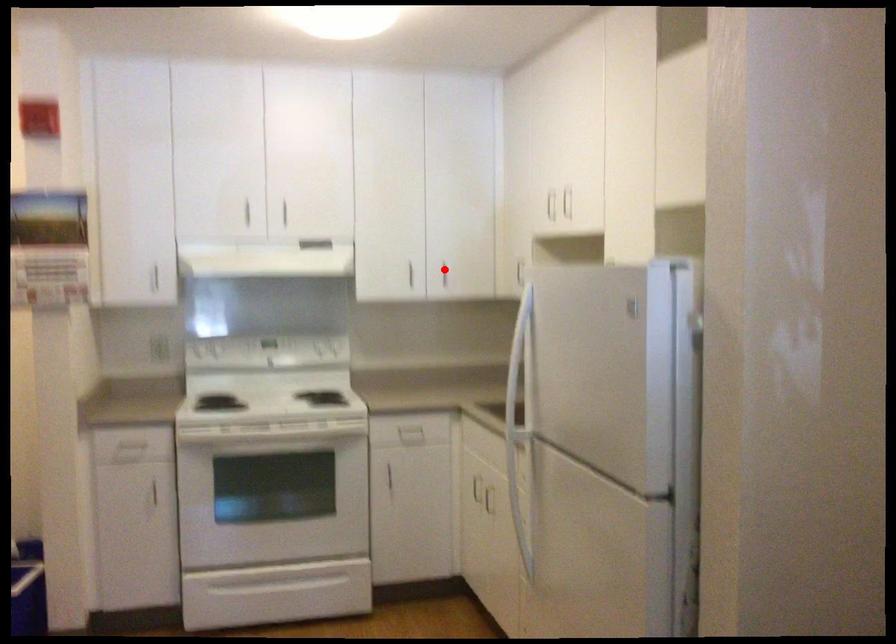
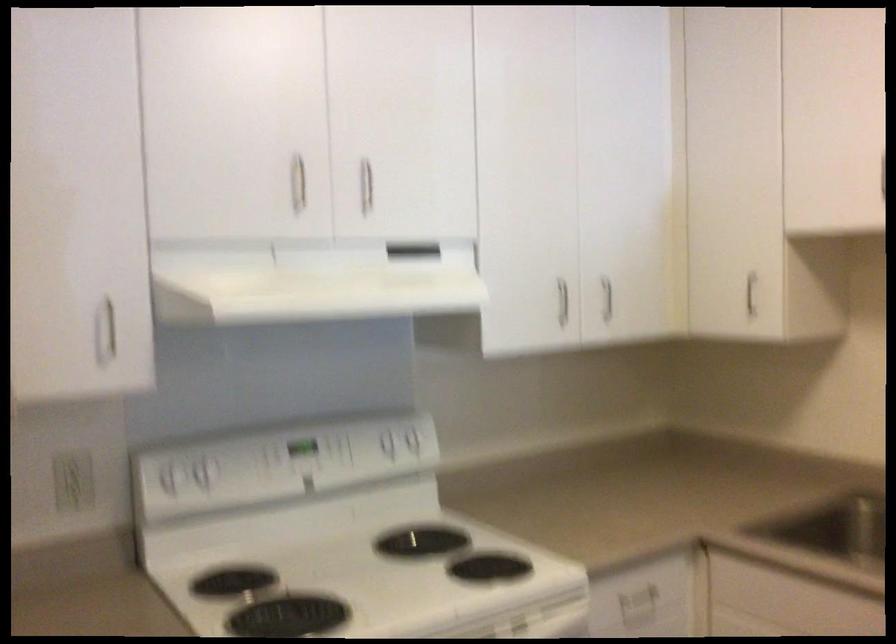
The point at the highlighted location is marked in the first image. Where is the corresponding point in the second image?

(607, 298)